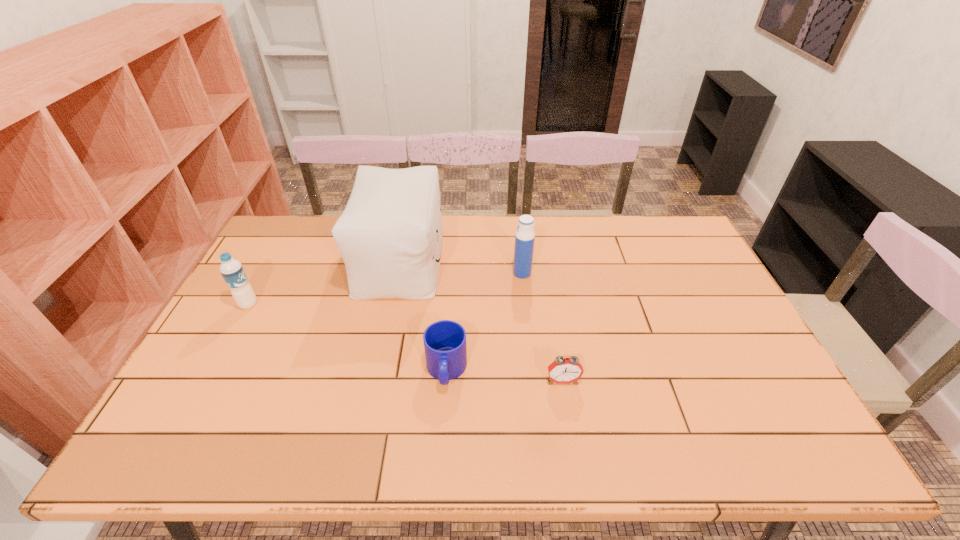
The width and height of the screenshot is (960, 540). In order to click on vacant area situated 0.140m on the side with the handle of the mug in this screenshot , I will do `click(441, 450)`.

You are a GUI agent. You are given a task and a screenshot of the screen. Output one action in this format:
    pyautogui.click(x=<x>, y=<y>)
    Task: Click on the vacant region located on the clock face of the alarm clock
    Image resolution: width=960 pixels, height=540 pixels.
    Given the screenshot: What is the action you would take?
    pyautogui.click(x=570, y=427)

This screenshot has height=540, width=960. What are the coordinates of `object that is at the far edge` in the screenshot? It's located at (390, 234).

This screenshot has height=540, width=960. What are the coordinates of `object located at the left edge` in the screenshot? It's located at (232, 271).

I want to click on free space at the far edge of the desktop, so click(605, 240).

This screenshot has height=540, width=960. I want to click on vacant space at the left edge, so click(x=285, y=298).

Identify the location of vacant space at the right edge. (694, 322).

In the image, there is a desktop. At what (x,y) coordinates should I click in order to perform the action: click on vacant space at the far left corner. Please return your answer as a coordinate pair (x, y). The image size is (960, 540). Looking at the image, I should click on (322, 218).

Find the location of a particular element. This screenshot has height=540, width=960. free spot at the far right corner of the desktop is located at coordinates (644, 218).

You are a GUI agent. You are given a task and a screenshot of the screen. Output one action in this format:
    pyautogui.click(x=<x>, y=<y>)
    Task: Click on the free space between the rightmost object and the mug
    The width and height of the screenshot is (960, 540).
    Given the screenshot: What is the action you would take?
    pyautogui.click(x=505, y=375)